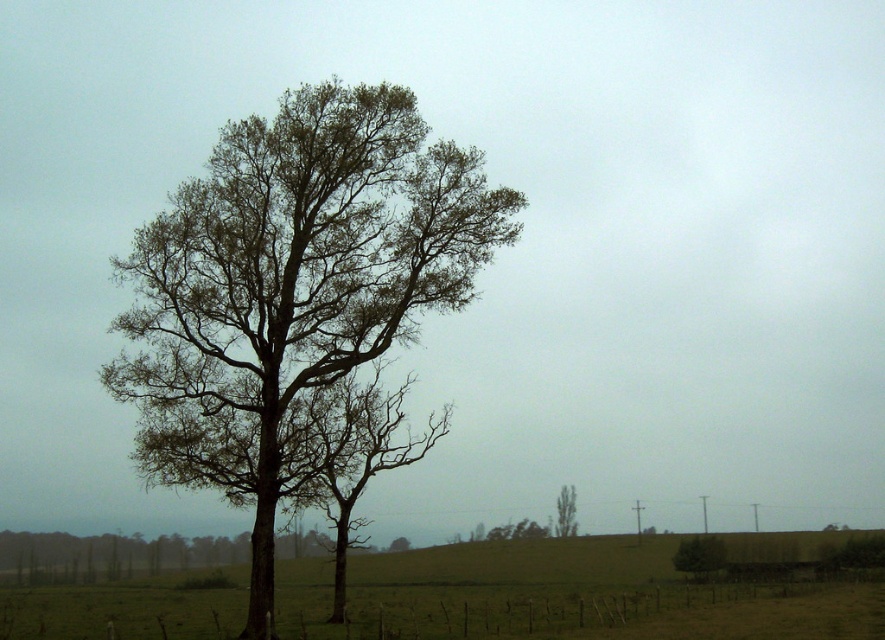
Question: Among these points, which one is farthest from the camera?

Choices:
 (A) (564, 516)
 (B) (44, 604)

Answer: (A)

Question: Does brown/dry wood tree at center have a greater width compared to green leafy tree at lower right?

Choices:
 (A) no
 (B) yes

Answer: (B)

Question: Which object is positioned closest to the green leafy tree at center?

Choices:
 (A) green leafy tree at lower right
 (B) green grass at center
 (C) brown/dry wood tree at center

Answer: (A)

Question: Is green grass at center above green leafy tree at center?

Choices:
 (A) yes
 (B) no

Answer: (B)

Question: Is green grass at center closer to camera compared to green leafy tree at lower right?

Choices:
 (A) yes
 (B) no

Answer: (A)

Question: Which point appears closest to the camera in this image?

Choices:
 (A) [563, 518]
 (B) [408, 620]
 (C) [687, 541]

Answer: (B)